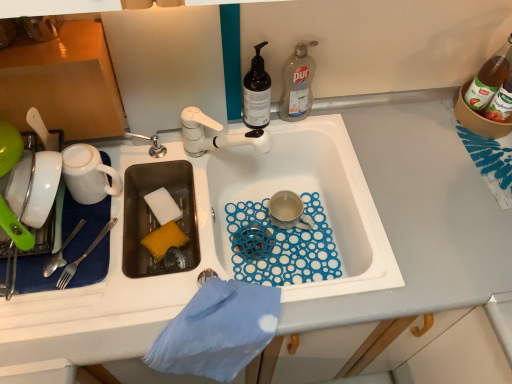
Where is `free area in between translucent glass bottle at upper right, the first bottle in the right-to-left sequence, and translucent dark brown bottle at upper center, the third bottle in the right-to-left sequence`? The image size is (512, 384). free area in between translucent glass bottle at upper right, the first bottle in the right-to-left sequence, and translucent dark brown bottle at upper center, the third bottle in the right-to-left sequence is located at coordinates (376, 117).